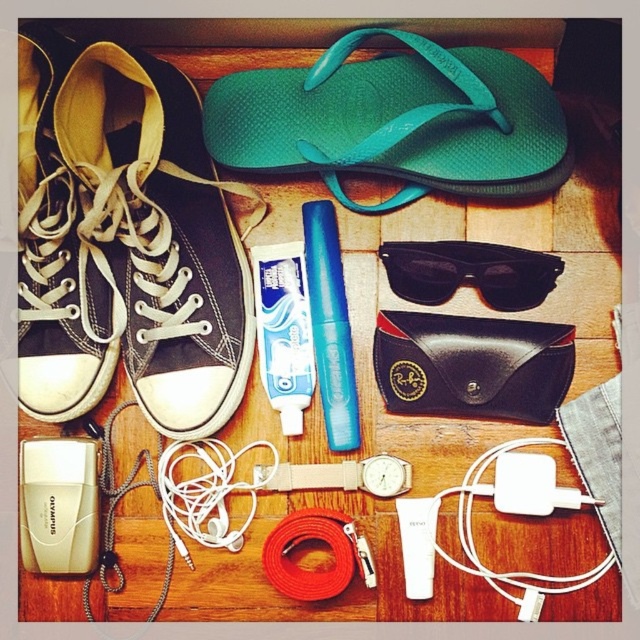
Between teal rubber flip-flop at upper center and white plastic power adapter at lower right, which one appears on the left side from the viewer's perspective?

teal rubber flip-flop at upper center

Does teal rubber flip-flop at upper center have a lesser height compared to white plastic power adapter at lower right?

In fact, teal rubber flip-flop at upper center may be taller than white plastic power adapter at lower right.

Is point (513, 81) positioned before point (540, 506)?

No, (513, 81) is behind (540, 506).

Where is `teal rubber flip-flop at upper center`? Image resolution: width=640 pixels, height=640 pixels. teal rubber flip-flop at upper center is located at coordinates (396, 122).

Does black canvas shoe at upper left appear over white plastic ipod at lower left?

Indeed, black canvas shoe at upper left is positioned over white plastic ipod at lower left.

Can you confirm if black canvas shoe at upper left is shorter than white plastic ipod at lower left?

In fact, black canvas shoe at upper left may be taller than white plastic ipod at lower left.

At what (x,y) coordinates should I click in order to perform the action: click on black canvas shoe at upper left. Please return your answer as a coordinate pair (x, y). The width and height of the screenshot is (640, 640). Looking at the image, I should click on (161, 234).

In the scene shown: Who is more forward, (518, 268) or (419, 497)?

Positioned in front is point (518, 268).

At what (x,y) coordinates should I click in order to perform the action: click on black matte sunglasses at center. Please return your answer as a coordinate pair (x, y). Looking at the image, I should click on (468, 273).